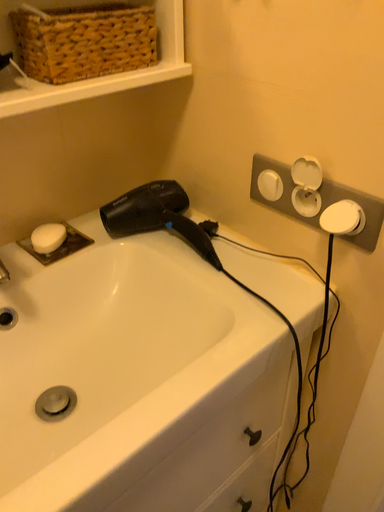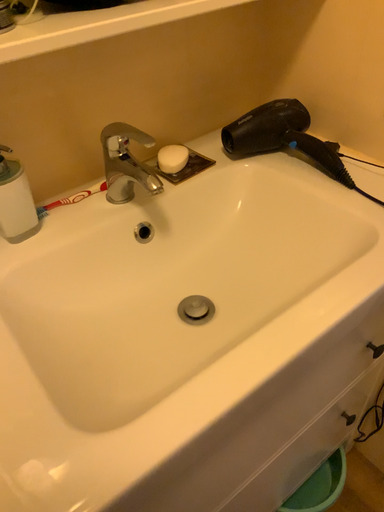
Question: How did the camera likely rotate when shooting the video?

Choices:
 (A) rotated upward
 (B) rotated downward

Answer: (B)